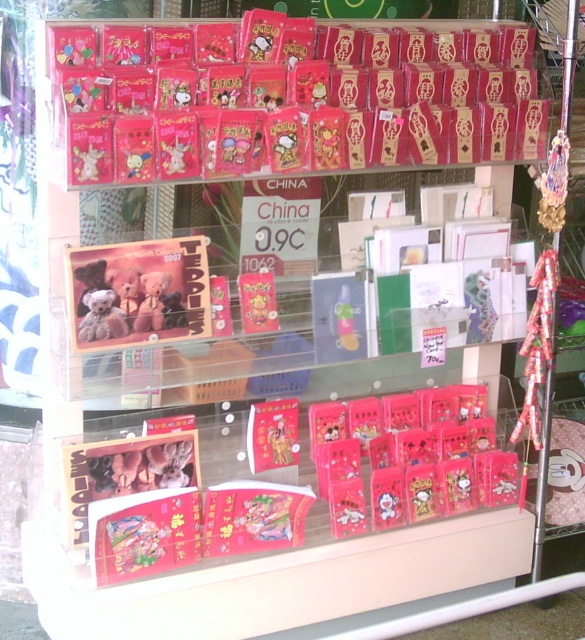
Which is above, matte red card at center or matte plastic toy at center?

Positioned higher is matte plastic toy at center.

Does matte red card at center have a lesser height compared to matte plastic toy at center?

Yes, matte red card at center is shorter than matte plastic toy at center.

Who is more distant from viewer, [269,426] or [338,337]?

The point [269,426] is behind.

Identify the location of matte red card at center. (283, 440).